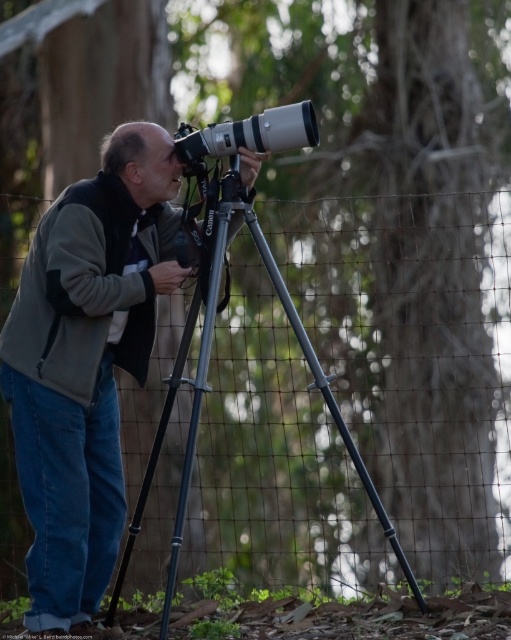
Is metallic gray tripod at center shorter than matte silver lens at center?

No.

Is metallic gray tripod at center wider than matte silver lens at center?

Indeed, metallic gray tripod at center has a greater width compared to matte silver lens at center.

Who is more forward, (191, 436) or (190, 156)?

Point (191, 436) is more forward.

Locate an element on the screen. The height and width of the screenshot is (640, 511). metallic gray tripod at center is located at coordinates pos(207,368).

Does matte gray jacket at center come in front of metallic gray tripod at center?

No, it is not.

Is point (48, 285) in front of point (215, 170)?

Yes, it is.

Find the location of a particular element. The width and height of the screenshot is (511, 640). matte gray jacket at center is located at coordinates (85, 364).

Consider the image. Who is more forward, [53,618] or [300,128]?

Positioned in front is point [53,618].

Which is behind, point (49, 353) or point (263, 128)?

The point (263, 128) is more distant.

The image size is (511, 640). What do you see at coordinates (85, 364) in the screenshot?
I see `matte gray jacket at center` at bounding box center [85, 364].

This screenshot has height=640, width=511. In order to click on matte gray jacket at center in this screenshot , I will do pyautogui.click(x=85, y=364).